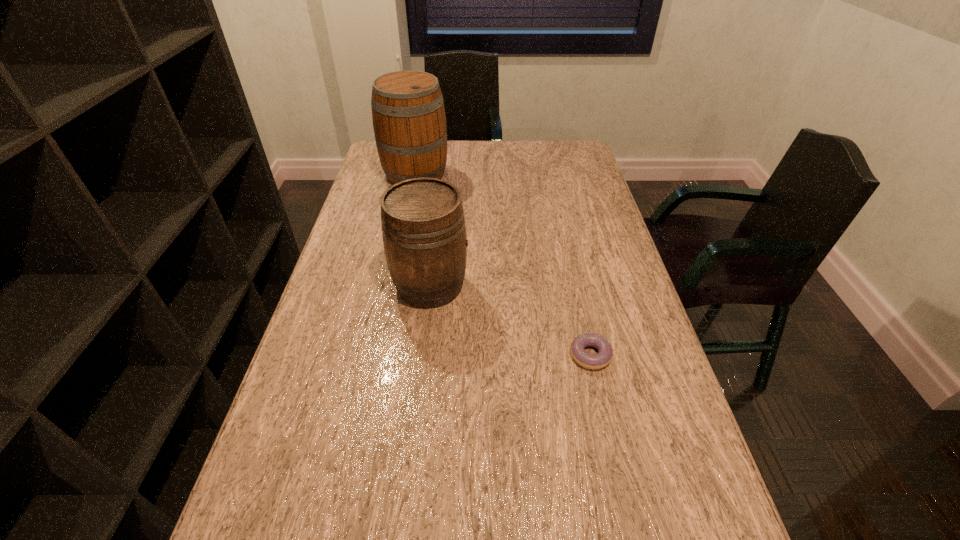
Locate an element on the screen. This screenshot has width=960, height=540. free spot between the shortest object and the tallest object is located at coordinates (503, 265).

Select which object is the second closest to the shortest object. Please provide its 2D coordinates. Your answer should be formatted as a tuple, i.e. [(x, y)], where the tuple contains the x and y coordinates of a point satisfying the conditions above.

[(408, 113)]

Point out which object is positioned as the nearest to the rightmost object. Please provide its 2D coordinates. Your answer should be formatted as a tuple, i.e. [(x, y)], where the tuple contains the x and y coordinates of a point satisfying the conditions above.

[(423, 227)]

At what (x,y) coordinates should I click in order to perform the action: click on free space that satisfies the following two spatial constraints: 1. on the side of the nearer cider near the bung hole; 2. on the right side of the rightmost object. Please return your answer as a coordinate pair (x, y). Looking at the image, I should click on (422, 355).

The height and width of the screenshot is (540, 960). I want to click on vacant position in the image that satisfies the following two spatial constraints: 1. on the side of the nearest object near the bung hole; 2. on the right side of the second tallest object, so click(422, 355).

Locate an element on the screen. The image size is (960, 540). free space that satisfies the following two spatial constraints: 1. on the side of the shorter cider near the bung hole; 2. on the right side of the rightmost object is located at coordinates (x=422, y=355).

The image size is (960, 540). I want to click on free space in the image that satisfies the following two spatial constraints: 1. on the side of the shorter cider near the bung hole; 2. on the back side of the doughnut, so click(422, 355).